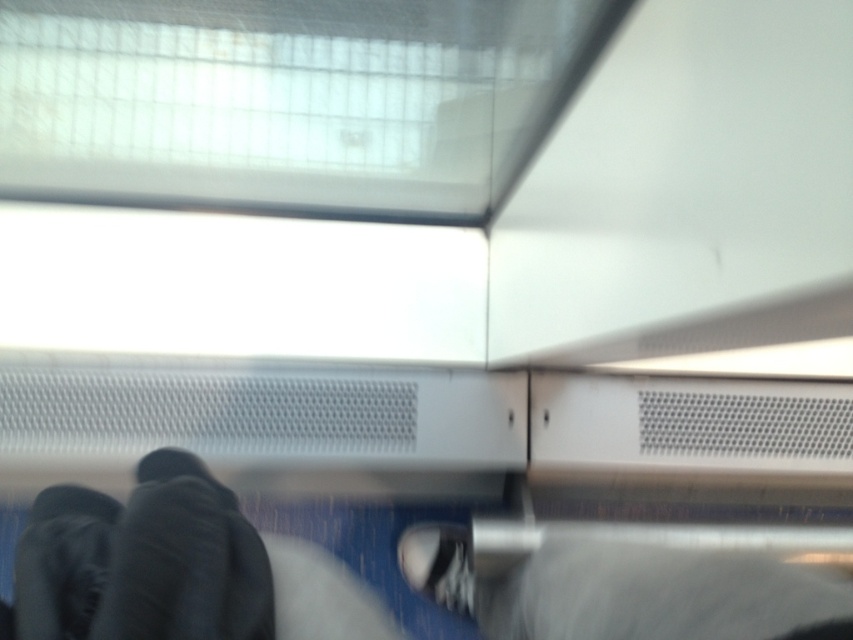
Does point (74, 499) come behind point (440, 604)?

No, it is in front of (440, 604).

In the scene shown: Does dark gray fabric jacket at lower left appear on the right side of white matte shoe at center?

No, dark gray fabric jacket at lower left is not to the right of white matte shoe at center.

Who is more distant from viewer, (167, 556) or (468, 570)?

The point (468, 570) is behind.

Where is `dark gray fabric jacket at lower left`? The height and width of the screenshot is (640, 853). dark gray fabric jacket at lower left is located at coordinates (141, 561).